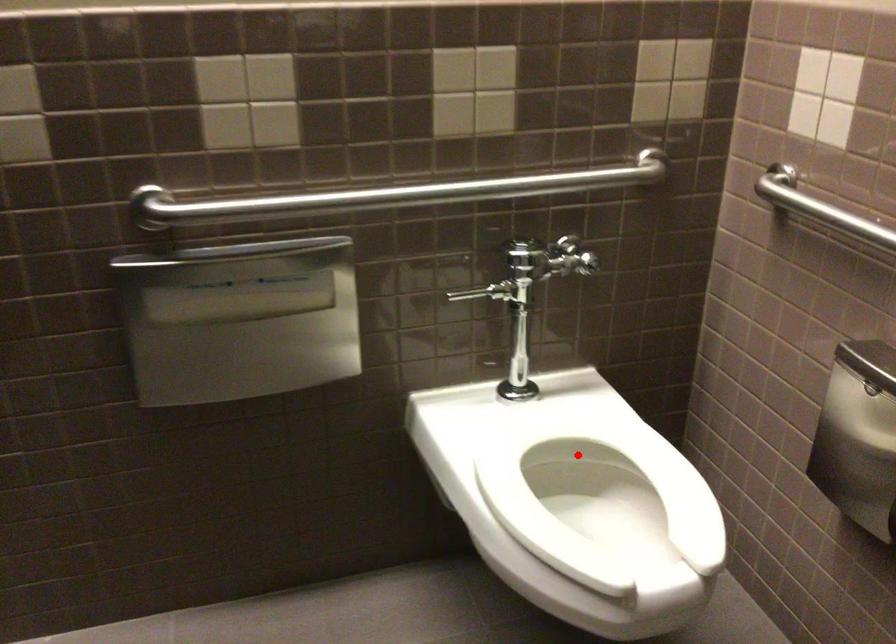
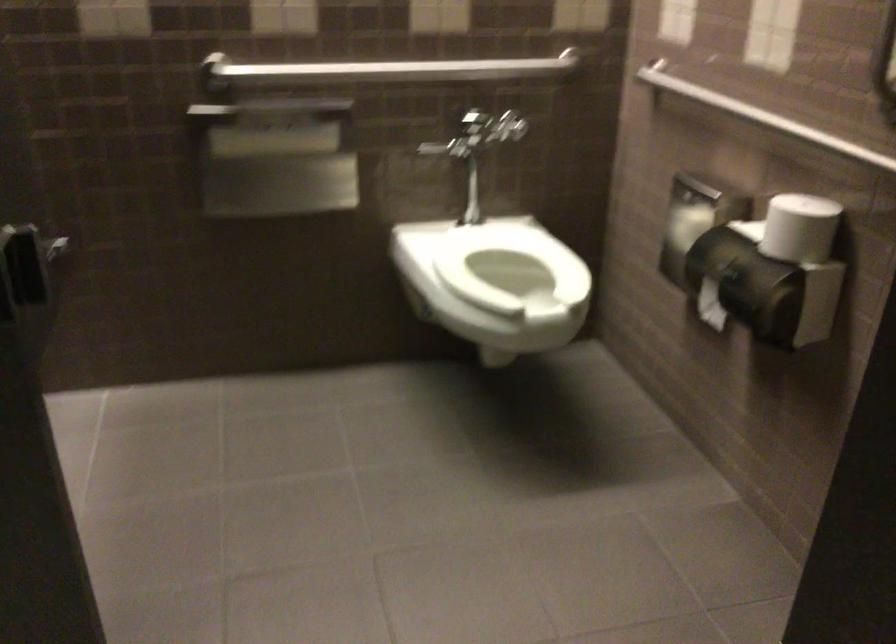
In the second image, find the point that corresponds to the highlighted location in the first image.

(509, 263)